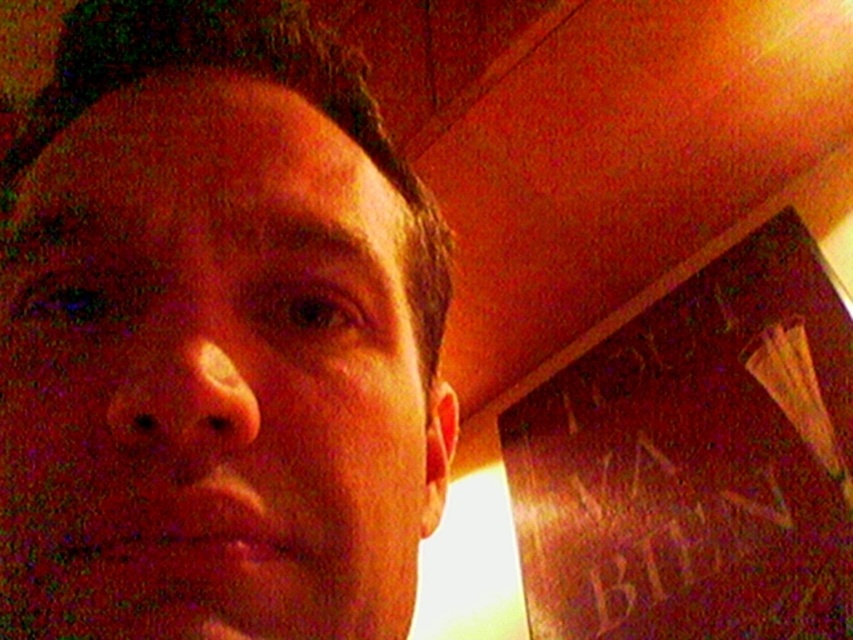
What are the coordinates of the matte skin at center in the image?

The matte skin at center is located at coordinates point (x=213, y=337).

You are taking a selfie and want to ensure that both points, point (196, 592) and point (567, 390), are visible in the frame. Based on the scene description, which point is closer to the camera?

Point (196, 592) is in front of point (567, 390), so it is closer to the camera.

You are a photographer adjusting the lighting for a portrait. You notice the matte skin at center and the wooden bulletin board at right in the frame. Based on their positions, which object is closer to the camera?

The matte skin at center is closer to the camera than the wooden bulletin board at right because it is positioned at a distance of 5.23 feet from the board, implying the skin is in front.